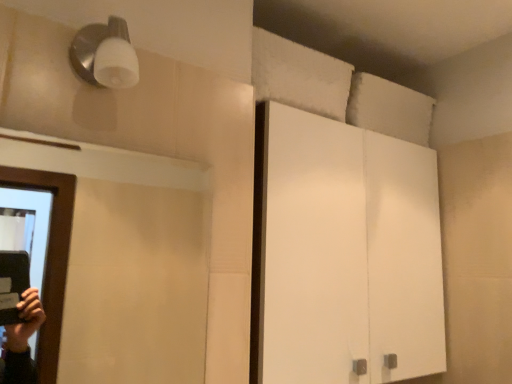
The height and width of the screenshot is (384, 512). Describe the element at coordinates (343, 254) in the screenshot. I see `white matte cabinet at center` at that location.

This screenshot has width=512, height=384. What are the coordinates of `white matte cabinet at center` in the screenshot? It's located at (343, 254).

Locate an element on the screen. Image resolution: width=512 pixels, height=384 pixels. white matte cabinet at center is located at coordinates (343, 254).